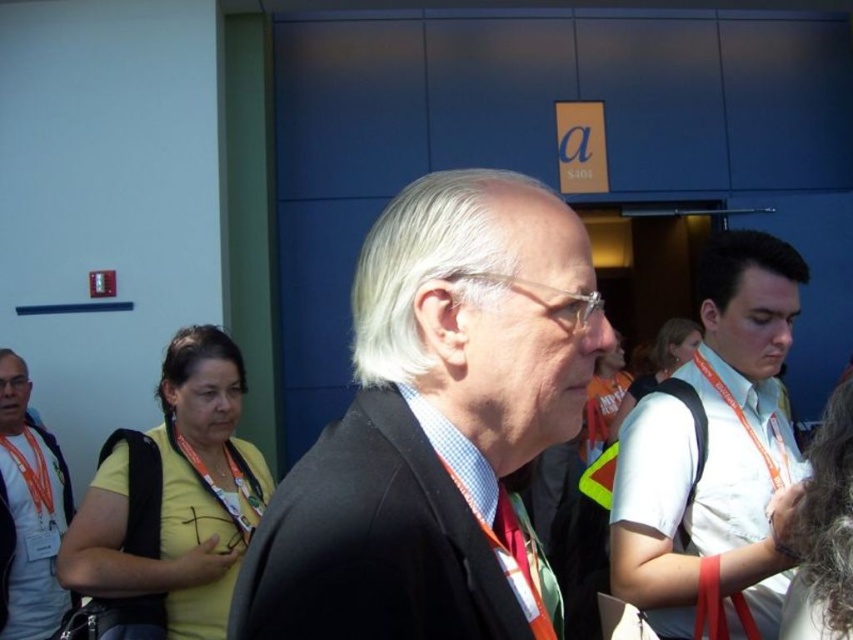
You are a photographer standing at the entrance of the building. You need to take a group photo of the white shirt at right and the black matte suit at center. The minimum distance required for your camera to focus properly is 36 inches. Will you be able to take a clear photo of both subjects at their current positions?

The white shirt at right is 35.77 inches away from the black matte suit at center. Since the minimum focus distance is 36 inches, the camera cannot focus properly at this distance. You need to move the subjects further apart or step back to ensure they are at least 36 inches apart for a clear photo.